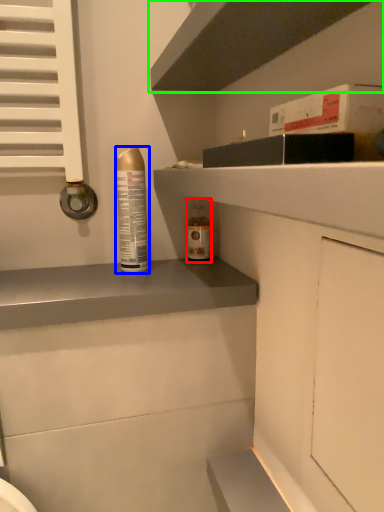
Question: Estimate the real-world distances between objects in this image. Which object is farther from bottle (highlighted by a red box), bottle (highlighted by a blue box) or shelf (highlighted by a green box)?

Choices:
 (A) bottle
 (B) shelf

Answer: (B)